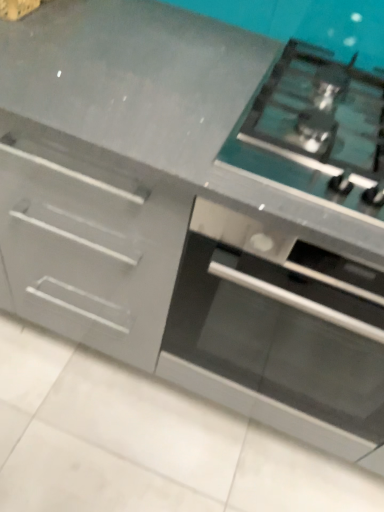
Question: Does point click(347, 142) appear closer or farther from the camera than point click(339, 335)?

Choices:
 (A) closer
 (B) farther

Answer: (A)

Question: Looking at their shapes, would you say satin silver gas stove at upper right is wider or thinner than stainless steel oven at center?

Choices:
 (A) thin
 (B) wide

Answer: (A)

Question: From the image's perspective, is satin silver gas stove at upper right positioned above or below stainless steel oven at center?

Choices:
 (A) above
 (B) below

Answer: (A)

Question: Is stainless steel oven at center taller or shorter than satin silver gas stove at upper right?

Choices:
 (A) tall
 (B) short

Answer: (A)

Question: Visually, is stainless steel oven at center positioned to the left or to the right of satin silver gas stove at upper right?

Choices:
 (A) left
 (B) right

Answer: (B)

Question: Looking at their shapes, would you say stainless steel oven at center is wider or thinner than satin silver gas stove at upper right?

Choices:
 (A) thin
 (B) wide

Answer: (B)

Question: From a real-world perspective, is stainless steel oven at center physically located above or below satin silver gas stove at upper right?

Choices:
 (A) below
 (B) above

Answer: (A)